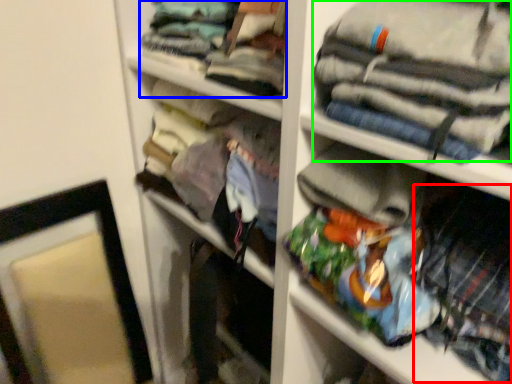
Question: Which is nearer to the clothing (highlighted by a red box)? clothing (highlighted by a blue box) or clothing (highlighted by a green box).

Choices:
 (A) clothing
 (B) clothing

Answer: (B)